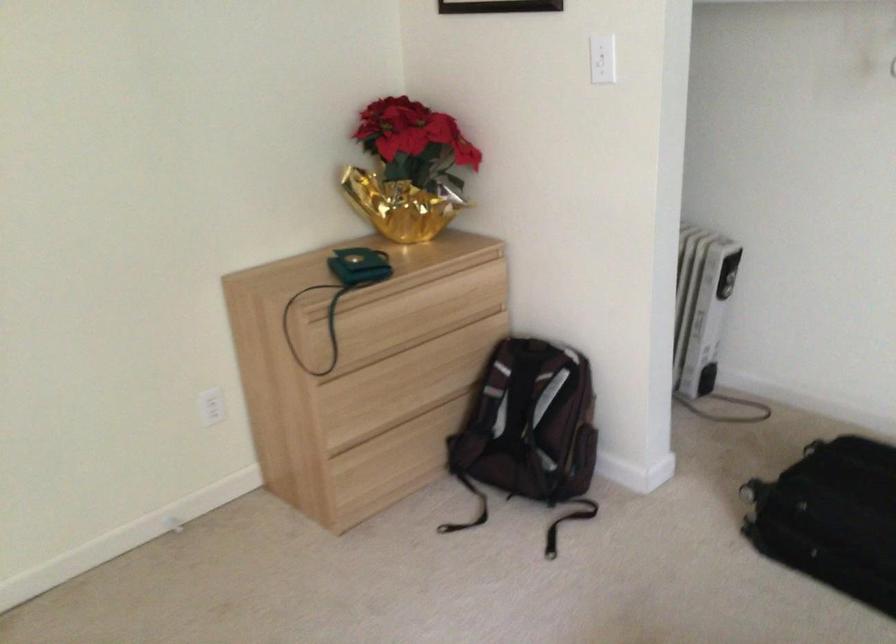
Find the location of a particular element. The width and height of the screenshot is (896, 644). white electrical outlet is located at coordinates (601, 59).